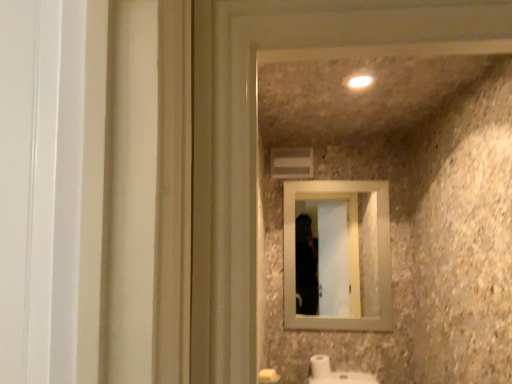
Question: From the image's perspective, is white glossy light at upper center on white matte toilet paper at lower center?

Choices:
 (A) no
 (B) yes

Answer: (B)

Question: Is white glossy light at upper center directly adjacent to white matte toilet paper at lower center?

Choices:
 (A) no
 (B) yes

Answer: (A)

Question: Is the depth of white glossy light at upper center less than that of white matte toilet paper at lower center?

Choices:
 (A) no
 (B) yes

Answer: (B)

Question: Is white glossy light at upper center to the right of white matte toilet paper at lower center from the viewer's perspective?

Choices:
 (A) yes
 (B) no

Answer: (A)

Question: Considering the relative sizes of white glossy light at upper center and white matte toilet paper at lower center in the image provided, is white glossy light at upper center thinner than white matte toilet paper at lower center?

Choices:
 (A) yes
 (B) no

Answer: (A)

Question: Does white glossy light at upper center have a greater height compared to white matte toilet paper at lower center?

Choices:
 (A) no
 (B) yes

Answer: (A)

Question: Would you say white glossy light at upper center is part of white matte toilet paper at lower center's contents?

Choices:
 (A) yes
 (B) no

Answer: (B)

Question: From the image's perspective, is white matte toilet paper at lower center on white glossy light at upper center?

Choices:
 (A) no
 (B) yes

Answer: (A)

Question: Considering the relative positions of white matte toilet paper at lower center and white glossy light at upper center in the image provided, is white matte toilet paper at lower center in front of white glossy light at upper center?

Choices:
 (A) no
 (B) yes

Answer: (A)

Question: From a real-world perspective, is white matte toilet paper at lower center below white glossy light at upper center?

Choices:
 (A) no
 (B) yes

Answer: (B)

Question: Can you confirm if white matte toilet paper at lower center is taller than white glossy light at upper center?

Choices:
 (A) no
 (B) yes

Answer: (B)

Question: Is white matte toilet paper at lower center wider than white glossy light at upper center?

Choices:
 (A) no
 (B) yes

Answer: (B)

Question: Is there a large distance between beige wood mirror at center and white glossy light at upper center?

Choices:
 (A) yes
 (B) no

Answer: (A)